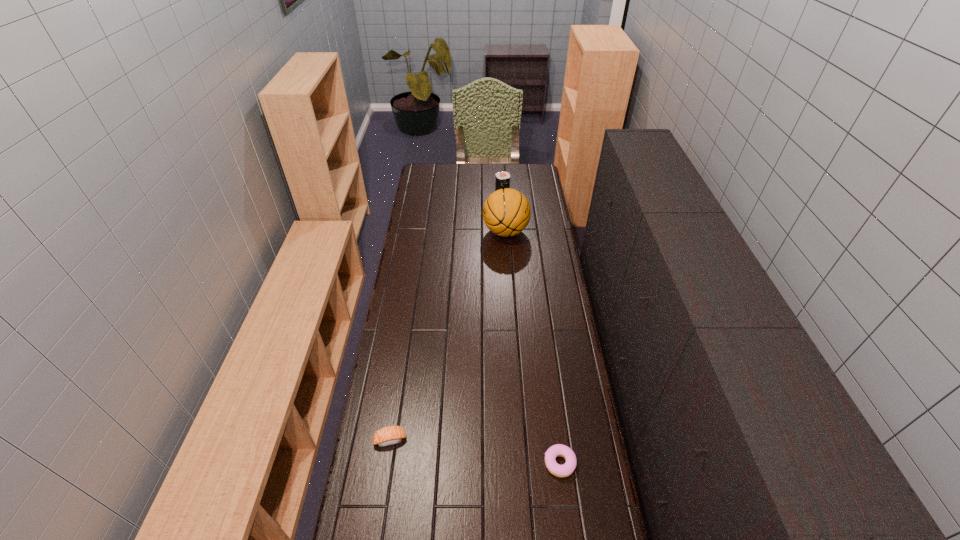
What are the coordinates of `the tallest object` in the screenshot? It's located at (506, 212).

Identify the location of the third nearest object. This screenshot has width=960, height=540. (506, 212).

Identify the location of the taller sushi. (502, 178).

Image resolution: width=960 pixels, height=540 pixels. Find the location of `the farther sushi`. the farther sushi is located at coordinates (x=502, y=178).

Find the location of `the shorter sushi`. the shorter sushi is located at coordinates (390, 435).

The image size is (960, 540). Find the location of `the left sushi`. the left sushi is located at coordinates (390, 435).

Find the location of a particular element. The width and height of the screenshot is (960, 540). doughnut is located at coordinates tap(565, 470).

You are a GUI agent. You are given a task and a screenshot of the screen. Output one action in this format:
    pyautogui.click(x=<x>, y=<y>)
    Task: Click on the shortest object
    Image resolution: width=960 pixels, height=540 pixels.
    Given the screenshot: What is the action you would take?
    pyautogui.click(x=565, y=470)

Identify the location of vacant space situated 0.380m on the surface of the third nearest object near the brand logo. (408, 232).

Find the location of a particular element. This screenshot has width=960, height=540. vacant region located on the surface of the third nearest object near the brand logo is located at coordinates (470, 232).